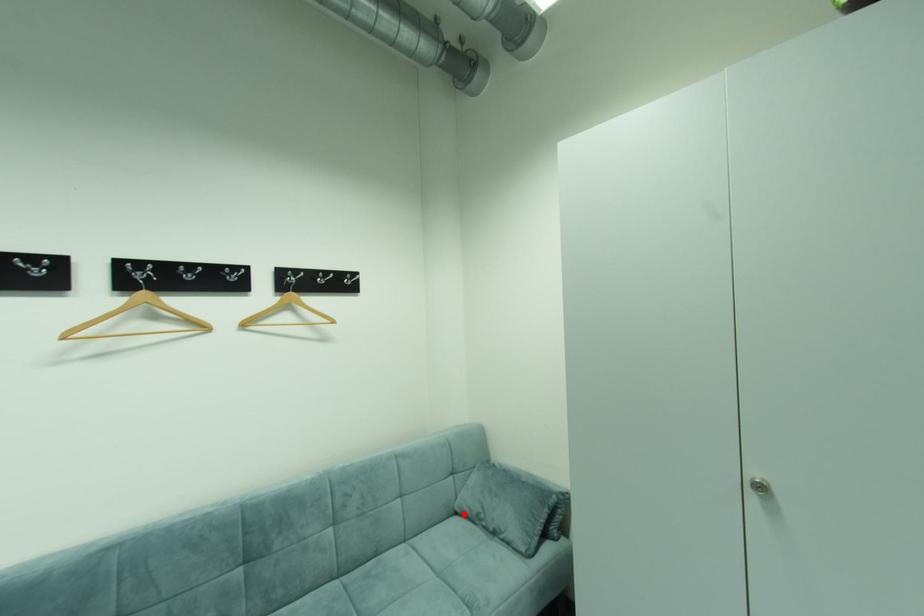
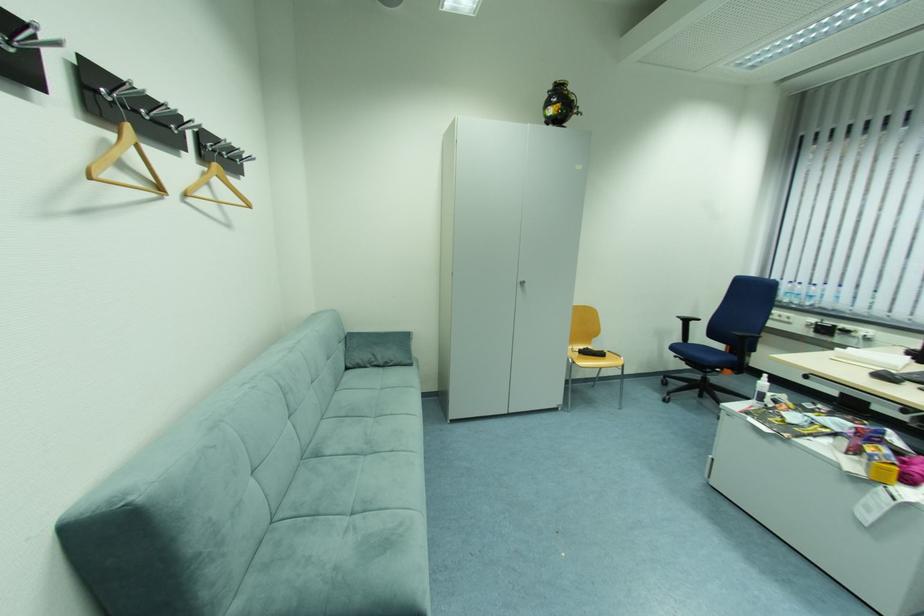
Question: I am providing you with two images of the same scene from different viewpoints. Image1 has a red point marked. In image2, the corresponding 3D location appears at what relative position? Reply with the corresponding letter.

Choices:
 (A) Closer
 (B) Farther

Answer: (A)